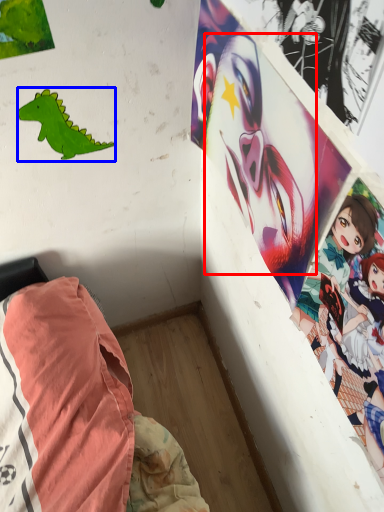
Question: Among these objects, which one is farthest to the camera, human face (highlighted by a red box) or dinosaur (highlighted by a blue box)?

Choices:
 (A) human face
 (B) dinosaur

Answer: (B)